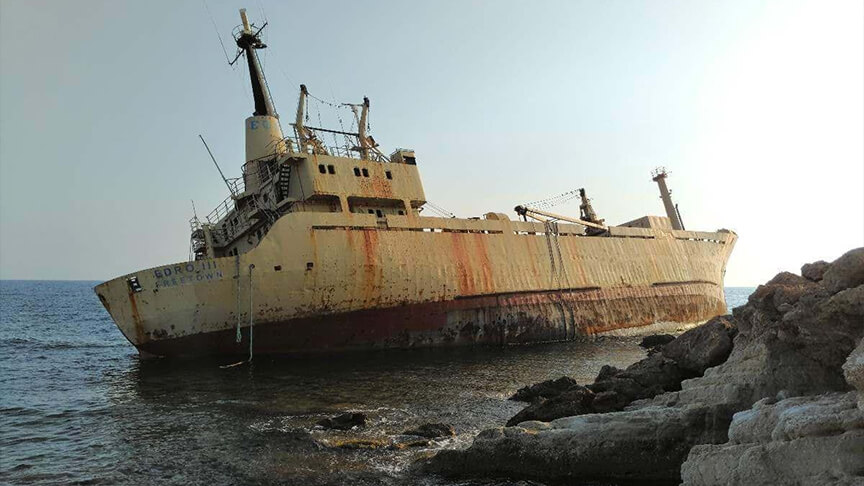
The height and width of the screenshot is (486, 864). Find the location of `windows`. windows is located at coordinates (358, 172), (369, 173).